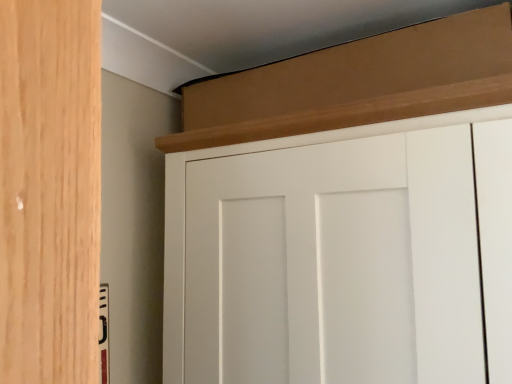
What do you see at coordinates (357, 70) in the screenshot? I see `brown wood trim at upper center` at bounding box center [357, 70].

Locate an element on the screen. brown wood trim at upper center is located at coordinates (357, 70).

I want to click on brown wood trim at upper center, so click(357, 70).